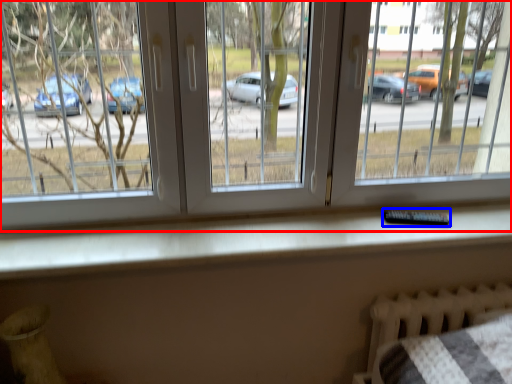
Question: Which point is further to the camera, window (highlighted by a red box) or remote (highlighted by a blue box)?

Choices:
 (A) window
 (B) remote

Answer: (B)